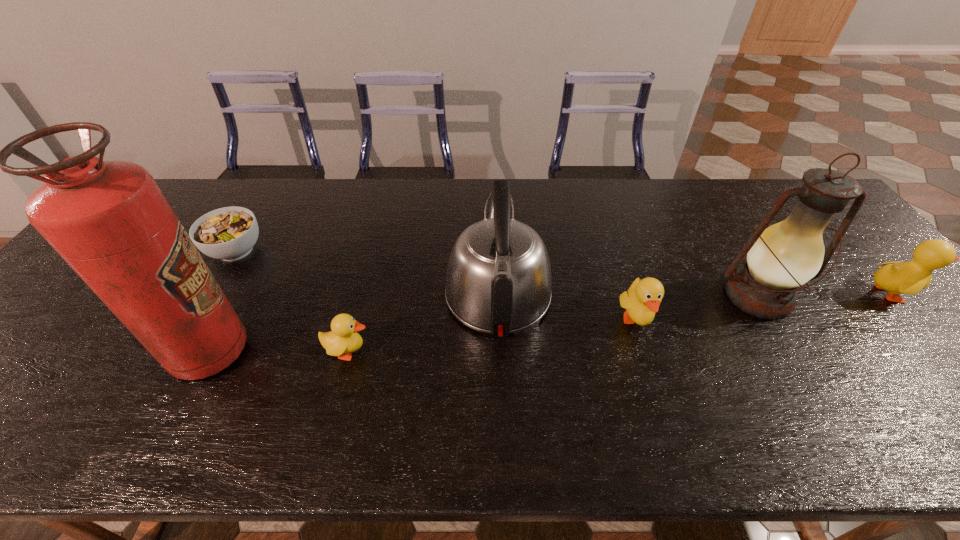
Find the location of a particular element. vacant space that satisfies the following two spatial constraints: 1. on the front side of the sixth object from left to right; 2. on the front-facing side of the third object from left to right is located at coordinates (790, 352).